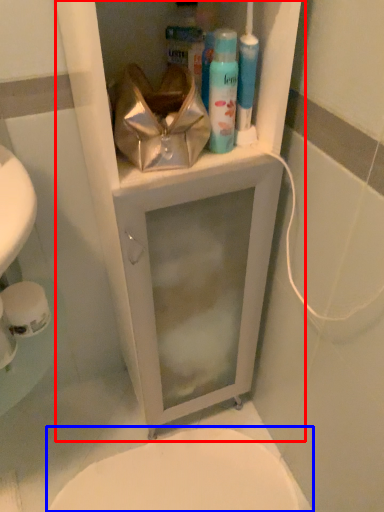
Question: Which object is closer to the camera taking this photo, medicine cabinet (highlighted by a red box) or bidet (highlighted by a blue box)?

Choices:
 (A) medicine cabinet
 (B) bidet

Answer: (A)